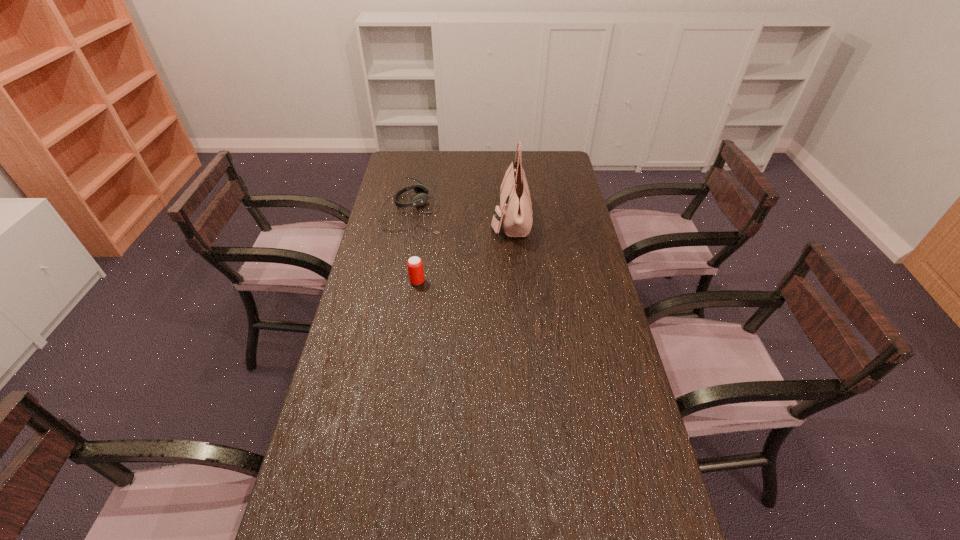
You are a GUI agent. You are given a task and a screenshot of the screen. Output one action in this format:
    pyautogui.click(x=<x>, y=<y>)
    Task: Click on the handbag
    This screenshot has height=540, width=960.
    Given the screenshot: What is the action you would take?
    pyautogui.click(x=516, y=212)

Where is `the rightmost object`? the rightmost object is located at coordinates (516, 212).

The width and height of the screenshot is (960, 540). In order to click on the second tallest object in this screenshot , I will do `click(414, 264)`.

I want to click on beer can, so click(x=414, y=264).

Locate an element on the screen. This screenshot has height=540, width=960. headset is located at coordinates (420, 198).

Locate an element on the screen. The width and height of the screenshot is (960, 540). vacant space located on the side of the handbag with the attached pouch is located at coordinates (456, 219).

You are a GUI agent. You are given a task and a screenshot of the screen. Output one action in this format:
    pyautogui.click(x=<x>, y=<y>)
    Task: Click on the vacant region located on the side of the handbag with the attached pouch
    This screenshot has height=540, width=960.
    Given the screenshot: What is the action you would take?
    pyautogui.click(x=429, y=219)

You are a GUI agent. You are given a task and a screenshot of the screen. Output one action in this format:
    pyautogui.click(x=<x>, y=<y>)
    Task: Click on the vacant space located 0.380m on the side of the handbag with the attached pouch
    Image resolution: width=960 pixels, height=540 pixels.
    Given the screenshot: What is the action you would take?
    pyautogui.click(x=397, y=219)

Locate an element on the screen. The image size is (960, 540). free space located 0.240m on the back of the nearest object is located at coordinates (424, 234).

This screenshot has width=960, height=540. I want to click on vacant region located 0.260m on the outer surface of the headset, so click(x=505, y=211).